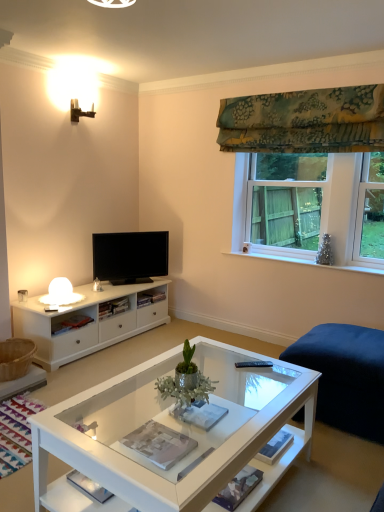
Locate an element on the screen. The height and width of the screenshot is (512, 384). green metallic plant at center is located at coordinates (186, 382).

Where is `black glossy tv at center`? The image size is (384, 512). black glossy tv at center is located at coordinates (130, 256).

The image size is (384, 512). What do you see at coordinates (130, 256) in the screenshot?
I see `black glossy tv at center` at bounding box center [130, 256].

You are a GUI agent. You are given a task and a screenshot of the screen. Output one action in this format:
    pyautogui.click(x=<x>, y=<y>)
    Task: Click on the white glass coffee table at center
    This screenshot has height=512, width=384.
    Given the screenshot: What is the action you would take?
    pyautogui.click(x=174, y=429)

Is clear glass window at upper right not within black glossy tv at center?

Yes, clear glass window at upper right is not within black glossy tv at center.

Is clear glass window at upper right next to black glossy tv at center?

No, clear glass window at upper right is not beside black glossy tv at center.

Which object is positioned more to the left, clear glass window at upper right or black glossy tv at center?

black glossy tv at center.

Which object is more forward, clear glass window at upper right or black glossy tv at center?

clear glass window at upper right is in front.

From the image's perspective, is black glossy tv at center positioned above or below white glass coffee table at center?

Clearly, from the image's perspective, black glossy tv at center is above white glass coffee table at center.

Based on the photo, considering the sizes of black glossy tv at center and white glass coffee table at center in the image, is black glossy tv at center wider or thinner than white glass coffee table at center?

Clearly, black glossy tv at center has less width compared to white glass coffee table at center.

Are black glossy tv at center and white glass coffee table at center far apart?

Yes, black glossy tv at center is far from white glass coffee table at center.

From a real-world perspective, which is physically above, black glossy tv at center or white glass coffee table at center?

black glossy tv at center is physically above.

Between white glass coffee table at center and green metallic plant at center, which one has larger size?

With larger size is white glass coffee table at center.

Is white glass coffee table at center spatially inside green metallic plant at center, or outside of it?

white glass coffee table at center lies outside green metallic plant at center.

Find the location of a particular element. Image resolution: width=384 pixels, height=512 pixels. coffee table on the left side of green metallic plant at center is located at coordinates (174, 429).

Does green floral fabric at upper right turn towards clear glass window at upper right?

No, green floral fabric at upper right is not turned towards clear glass window at upper right.

From the image's perspective, would you say green floral fabric at upper right is shown under clear glass window at upper right?

No, from the image's perspective, green floral fabric at upper right is not below clear glass window at upper right.

Would you say green floral fabric at upper right is a long distance from clear glass window at upper right?

green floral fabric at upper right is near clear glass window at upper right, not far away.

Where is `curtain positioned vertically above the clear glass window at upper right (from a real-world perspective)`? The width and height of the screenshot is (384, 512). curtain positioned vertically above the clear glass window at upper right (from a real-world perspective) is located at coordinates (304, 121).

Considering the relative sizes of green metallic plant at center and clear glass window at upper right in the image provided, is green metallic plant at center thinner than clear glass window at upper right?

No.

Which is in front, green metallic plant at center or clear glass window at upper right?

green metallic plant at center is more forward.

From a real-world perspective, is green metallic plant at center positioned above or below clear glass window at upper right?

In terms of real-world spatial position, green metallic plant at center is below clear glass window at upper right.

From the image's perspective, which one is positioned lower, green metallic plant at center or clear glass window at upper right?

green metallic plant at center is shown below in the image.

In the image, is green floral fabric at upper right on the left side or the right side of green metallic plant at center?

green floral fabric at upper right is positioned on green metallic plant at center's right side.

Does point (381, 111) appear closer or farther from the camera than point (181, 404)?

Clearly, point (381, 111) is more distant from the camera than point (181, 404).

Is green floral fabric at upper right positioned in front of green metallic plant at center?

No, it is behind green metallic plant at center.

Is green floral fabric at upper right taller than green metallic plant at center?

Yes, green floral fabric at upper right is taller than green metallic plant at center.

Between green floral fabric at upper right and white glass coffee table at center, which one appears on the right side from the viewer's perspective?

Positioned to the right is green floral fabric at upper right.

From the image's perspective, which one is positioned lower, green floral fabric at upper right or white glass coffee table at center?

white glass coffee table at center is shown below in the image.

The width and height of the screenshot is (384, 512). I want to click on curtain on the right of white glass coffee table at center, so click(304, 121).

Is green floral fabric at upper right positioned beyond the bounds of white glass coffee table at center?

That's correct, green floral fabric at upper right is outside of white glass coffee table at center.

I want to click on television on the left of clear glass window at upper right, so [x=130, y=256].

The height and width of the screenshot is (512, 384). In order to click on coffee table below the black glossy tv at center (from a real-world perspective) in this screenshot , I will do `click(174, 429)`.

In the scene shown: Estimate the real-world distances between objects in this image. Which object is further from black glossy tv at center, green floral fabric at upper right or green metallic plant at center?

The object further to black glossy tv at center is green metallic plant at center.

Considering their positions, is clear glass window at upper right positioned further to white glass coffee table at center than green metallic plant at center?

clear glass window at upper right lies further to white glass coffee table at center than the other object.

Looking at the image, which one is located closer to green metallic plant at center, clear glass window at upper right or white glass coffee table at center?

white glass coffee table at center is positioned closer to the anchor green metallic plant at center.

Looking at the image, which one is located further to green metallic plant at center, green floral fabric at upper right or white glass coffee table at center?

green floral fabric at upper right is further to green metallic plant at center.

From the image, which object appears to be nearer to clear glass window at upper right, black glossy tv at center or green floral fabric at upper right?

The object closer to clear glass window at upper right is green floral fabric at upper right.

When comparing their distances from green floral fabric at upper right, does black glossy tv at center or clear glass window at upper right seem closer?

The object closer to green floral fabric at upper right is clear glass window at upper right.

Which object lies further to the anchor point white glass coffee table at center, black glossy tv at center or clear glass window at upper right?

clear glass window at upper right is positioned further to the anchor white glass coffee table at center.

Which object lies further to the anchor point green metallic plant at center, white glass coffee table at center or black glossy tv at center?

black glossy tv at center is positioned further to the anchor green metallic plant at center.

You are a GUI agent. You are given a task and a screenshot of the screen. Output one action in this format:
    pyautogui.click(x=<x>, y=<y>)
    Task: Click on the window that lies between green floral fabric at upper right and green metallic plant at center from top to bottom
    
    Given the screenshot: What is the action you would take?
    pyautogui.click(x=285, y=203)

Identify the location of houseplant between green floral fabric at upper right and white glass coffee table at center in the up-down direction. (186, 382).

Where is `window between white glass coffee table at center and black glossy tv at center in the front-back direction`? window between white glass coffee table at center and black glossy tv at center in the front-back direction is located at coordinates (285, 203).

Identify the location of curtain between white glass coffee table at center and clear glass window at upper right along the z-axis. The width and height of the screenshot is (384, 512). (304, 121).